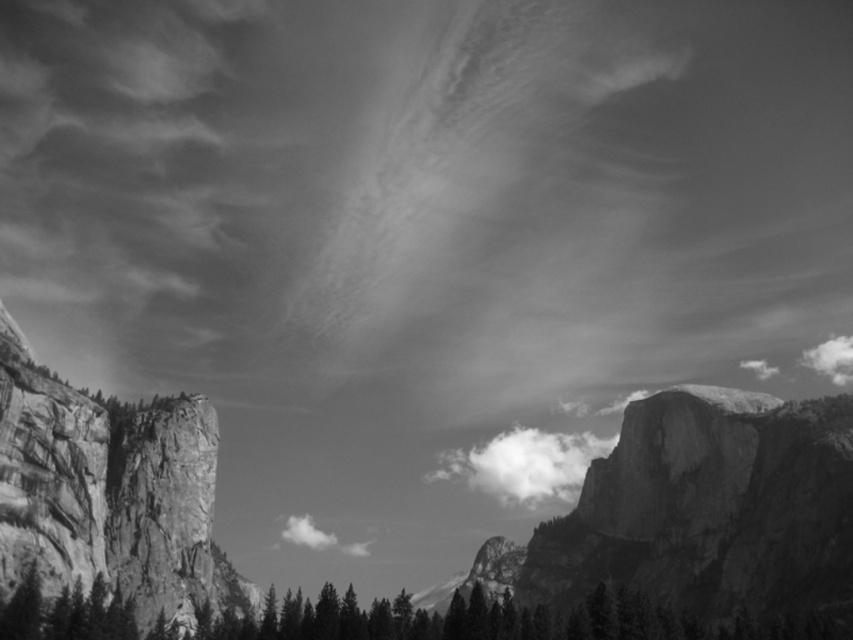
Identify the location of smooth dark green trees at lower center. This screenshot has height=640, width=853. (503, 620).

Does smooth dark green trees at lower center lie behind white cotton cloud at center?

No.

Is point (12, 620) farther from camera compared to point (282, 536)?

No.

Locate an element on the screen. The width and height of the screenshot is (853, 640). smooth dark green trees at lower center is located at coordinates (503, 620).

Who is lower down, white fluffy cloud at center or white cotton cloud at center?

white cotton cloud at center

Is white fluffy cloud at center bigger than white cotton cloud at center?

Yes.

The image size is (853, 640). What do you see at coordinates (525, 465) in the screenshot? I see `white fluffy cloud at center` at bounding box center [525, 465].

You are a GUI agent. You are given a task and a screenshot of the screen. Output one action in this format:
    pyautogui.click(x=<x>, y=<y>)
    Task: Click on the white fluffy cloud at center
    This screenshot has height=640, width=853.
    Given the screenshot: What is the action you would take?
    pyautogui.click(x=525, y=465)

Can you confirm if white fluffy cloud at upper right is positioned above white cotton cloud at center?

Indeed, white fluffy cloud at upper right is positioned over white cotton cloud at center.

The height and width of the screenshot is (640, 853). What do you see at coordinates (831, 358) in the screenshot?
I see `white fluffy cloud at upper right` at bounding box center [831, 358].

Between point (840, 349) and point (308, 518), which one is positioned behind?

Positioned behind is point (840, 349).

Where is `white fluffy cloud at upper right`? The width and height of the screenshot is (853, 640). white fluffy cloud at upper right is located at coordinates pos(831,358).